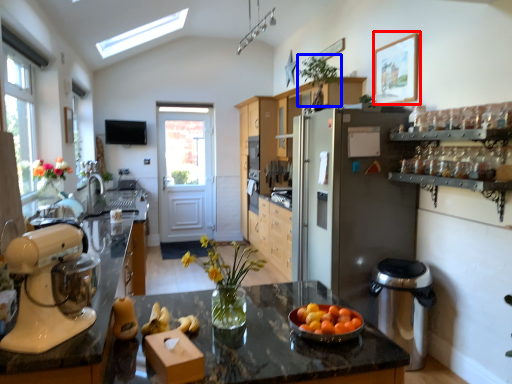
Question: Which of the following is the farthest to the observer, picture frame (highlighted by a red box) or plant (highlighted by a blue box)?

Choices:
 (A) picture frame
 (B) plant

Answer: (B)